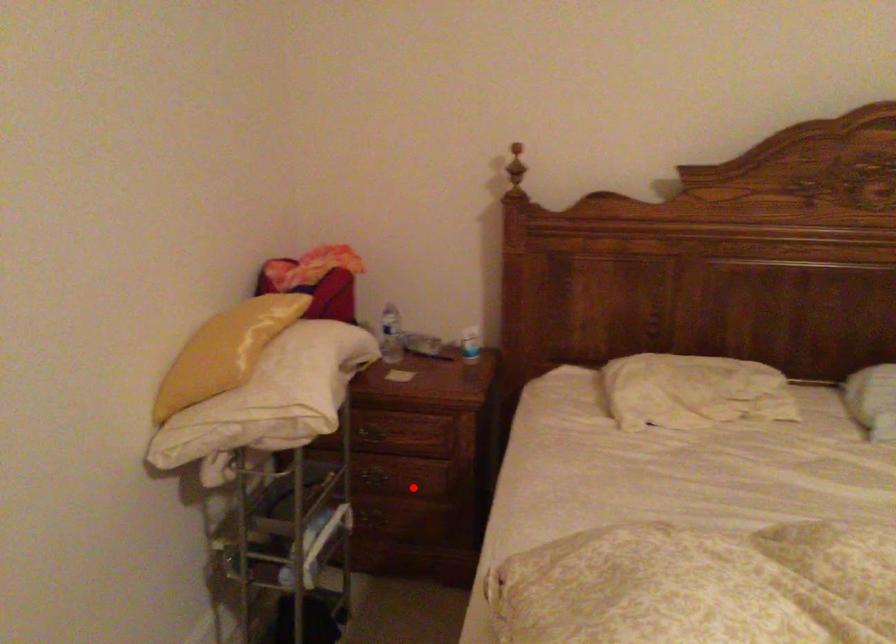
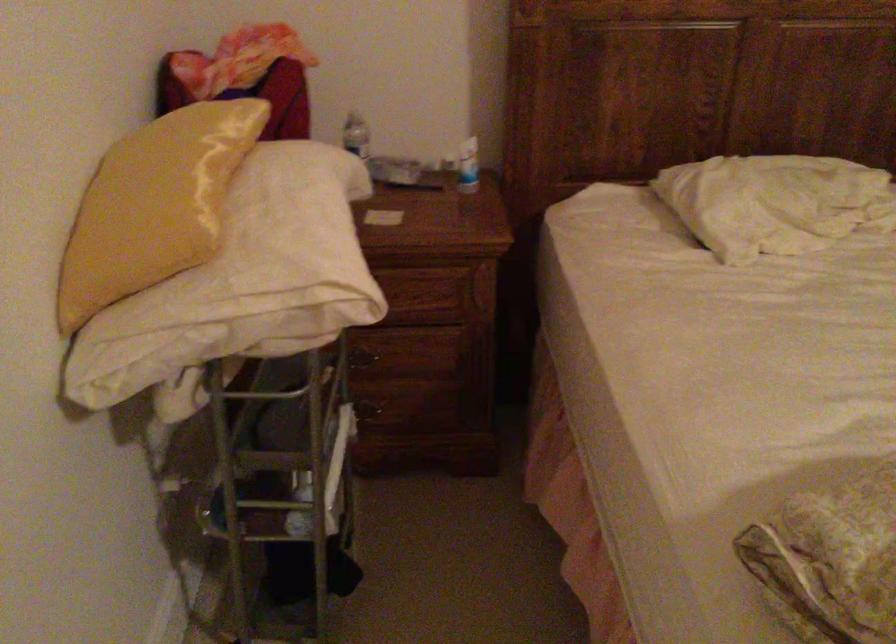
In the second image, find the point that corresponds to the highlighted location in the first image.

(412, 365)